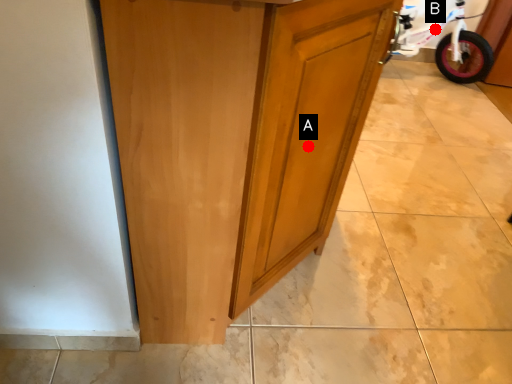
Question: Two points are circled on the image, labeled by A and B beside each circle. Among these points, which one is nearest to the camera?

Choices:
 (A) A is closer
 (B) B is closer

Answer: (A)